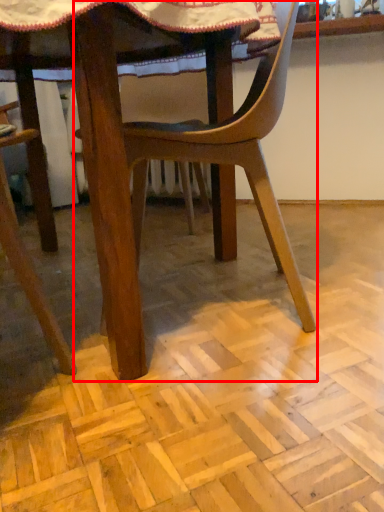
Question: From the image's perspective, where is chair (annotated by the red box) located in relation to plywood in the image?

Choices:
 (A) above
 (B) below

Answer: (A)